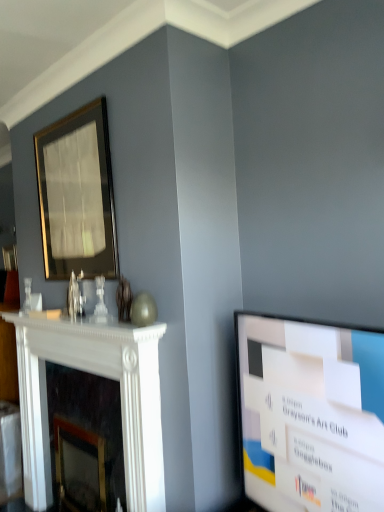
Question: Choose the correct answer: Is white marble fireplace at left inside gold-framed mirror at upper left or outside it?

Choices:
 (A) outside
 (B) inside

Answer: (A)

Question: Is white marble fireplace at left bigger or smaller than gold-framed mirror at upper left?

Choices:
 (A) small
 (B) big

Answer: (B)

Question: Based on their relative distances, which object is farther from the gold-framed mirror at upper left?

Choices:
 (A) white marble fireplace at left
 (B) white glossy screen at right

Answer: (B)

Question: Based on their relative distances, which object is farther from the white marble fireplace at left?

Choices:
 (A) white glossy screen at right
 (B) gold-framed mirror at upper left

Answer: (A)